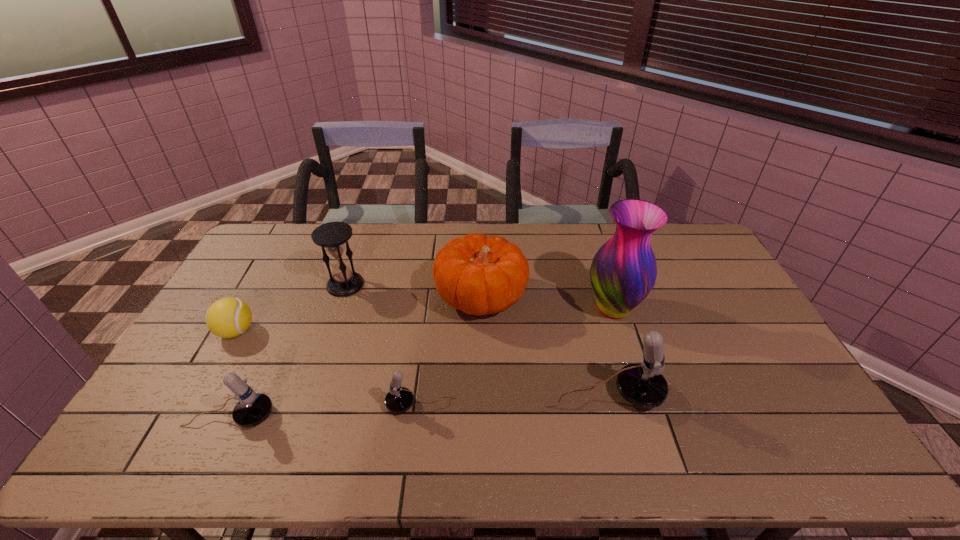
Where is `free space located on the right of the rightmost microphone`? free space located on the right of the rightmost microphone is located at coordinates (760, 394).

You are a GUI agent. You are given a task and a screenshot of the screen. Output one action in this format:
    pyautogui.click(x=<x>, y=<y>)
    Task: Click on the vacant space positioned on the front of the fifth object from right to left
    
    Given the screenshot: What is the action you would take?
    pyautogui.click(x=324, y=347)

At what (x,y) coordinates should I click in order to perform the action: click on free region located 0.120m on the left of the pumpkin. Please return your answer as a coordinate pair (x, y). This screenshot has height=540, width=960. Looking at the image, I should click on (398, 298).

The width and height of the screenshot is (960, 540). I want to click on free spot located 0.110m on the right of the vase, so click(677, 308).

Where is `vacant space located 0.110m on the front of the tennis ball`? vacant space located 0.110m on the front of the tennis ball is located at coordinates (210, 377).

Identify the location of microphone situated at the left edge. This screenshot has height=540, width=960. (253, 408).

Locate an element on the screen. tennis ball located at the left edge is located at coordinates (229, 317).

I want to click on object present at the near left corner, so click(x=253, y=408).

At what (x,y) coordinates should I click in order to perform the action: click on blank area at the far edge. Please return your answer as a coordinate pair (x, y). Looking at the image, I should click on click(492, 224).

In the image, there is a desktop. At what (x,y) coordinates should I click in order to perform the action: click on free space at the near edge. Please return your answer as a coordinate pair (x, y). The width and height of the screenshot is (960, 540). Looking at the image, I should click on (296, 395).